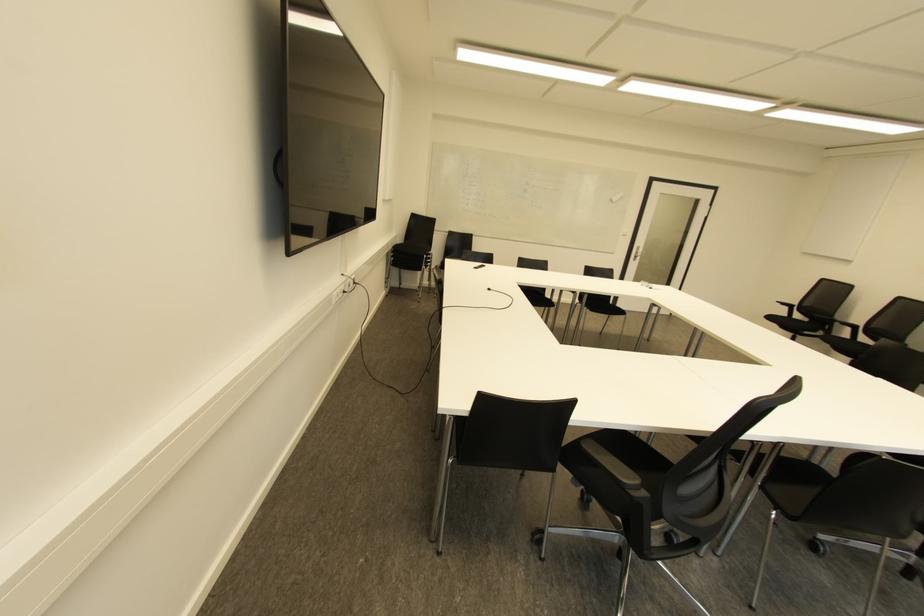
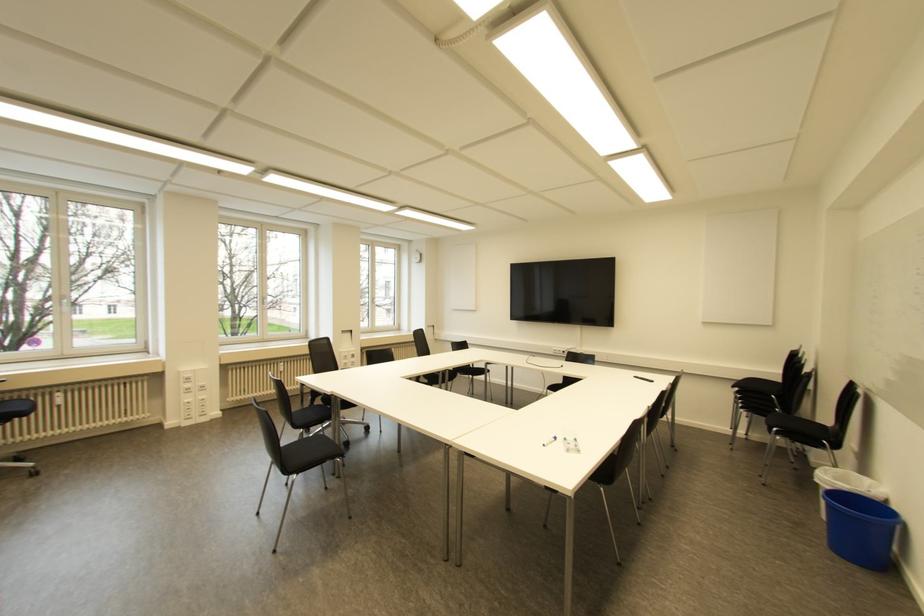
Question: I am providing you with two images of the same scene from different viewpoints. Please identify which objects are invisible in image2.

Choices:
 (A) whiteboard marker
 (B) beige storage box
 (C) chair sitting surface
 (D) black chair sitting surface

Answer: (C)